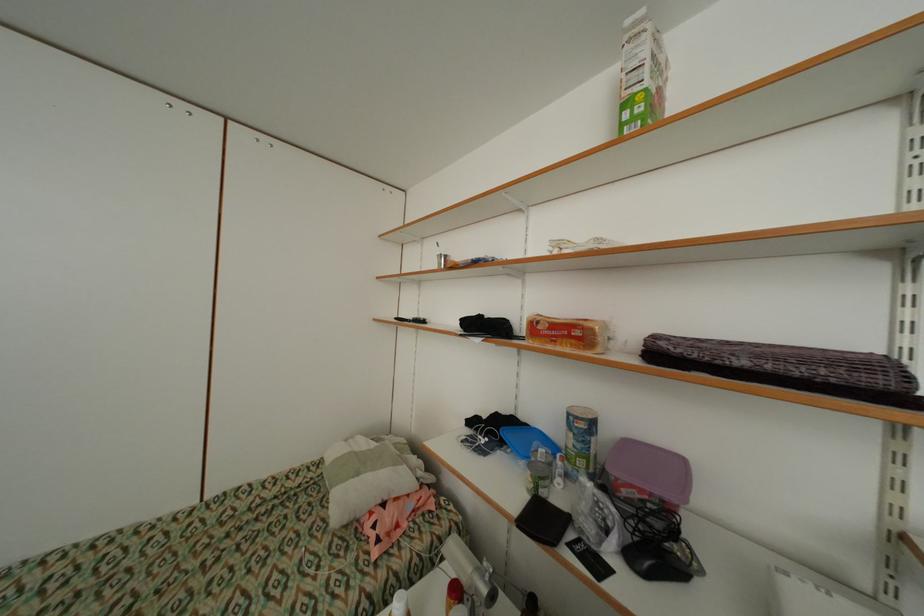
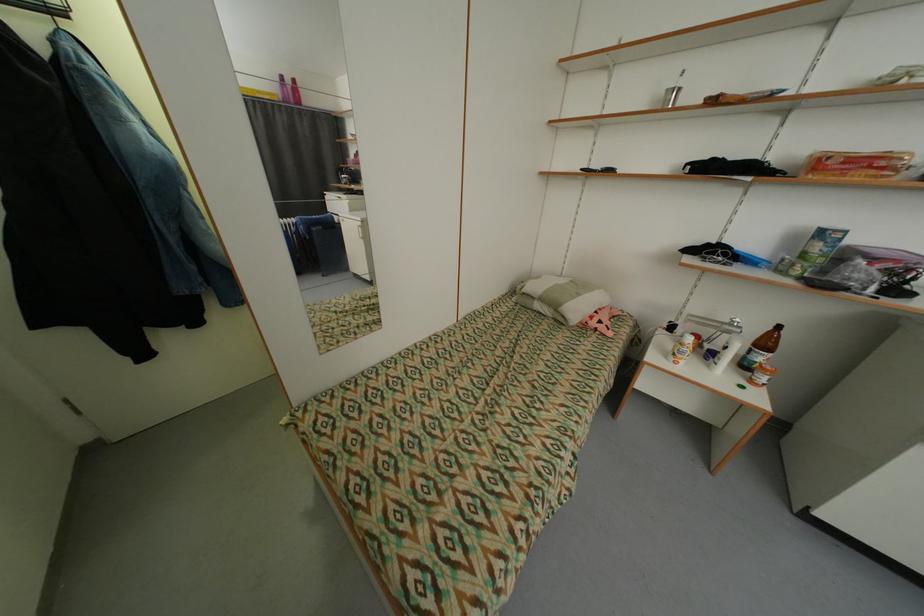
Find the pixel in the second image that matches point 363,475 in the first image.

(585, 296)